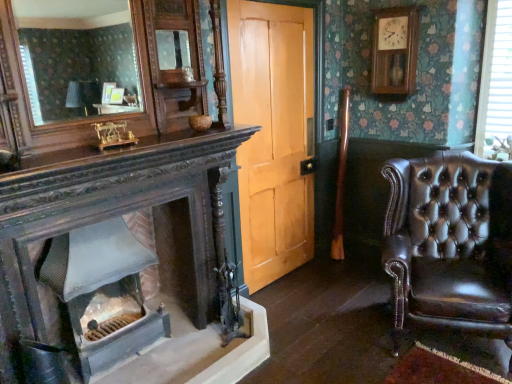
I want to click on vacant area that lies between shiny brown leather armchair at right and light brown wood door at center, so click(x=333, y=305).